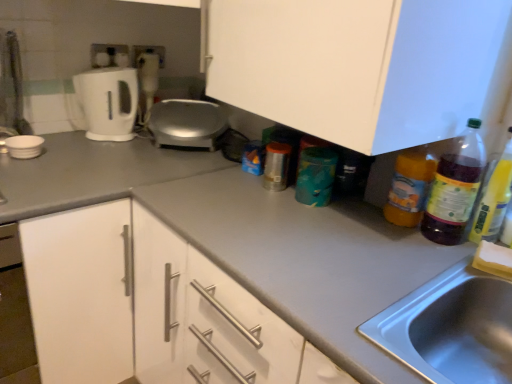
Identify the location of free space in front of translucent plastic bottle at right. (432, 261).